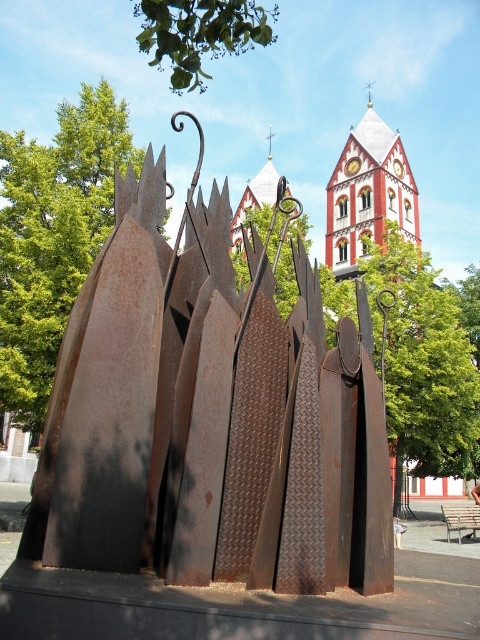
Which is behind, point (189, 262) or point (468, 518)?

Positioned behind is point (468, 518).

Who is lower down, rusty metal sculpture at center or brown wooden park bench at center?

Positioned lower is brown wooden park bench at center.

Who is more distant from viewer, (383, 486) or (467, 508)?

Point (467, 508)

Identify the location of rusty metal sculpture at center. The width and height of the screenshot is (480, 640). (210, 417).